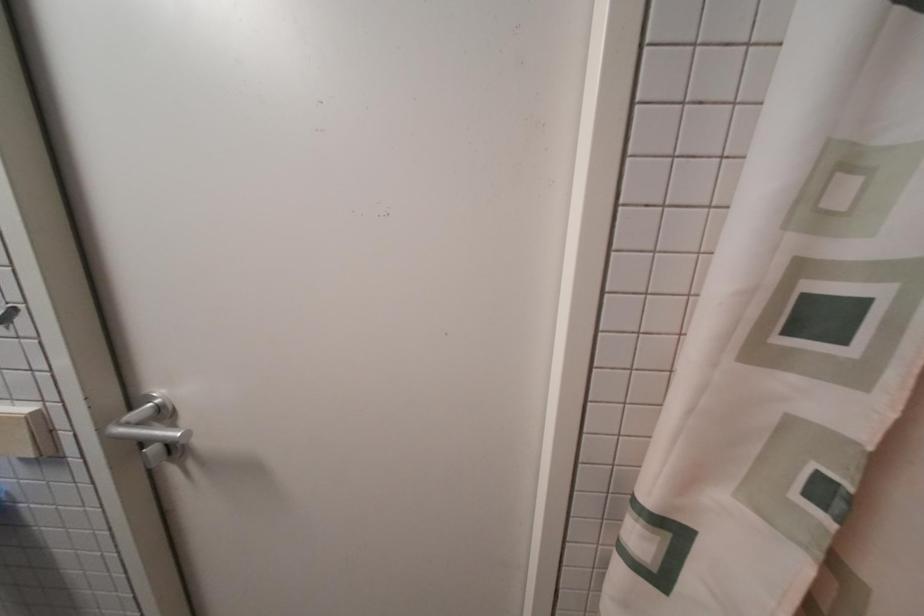
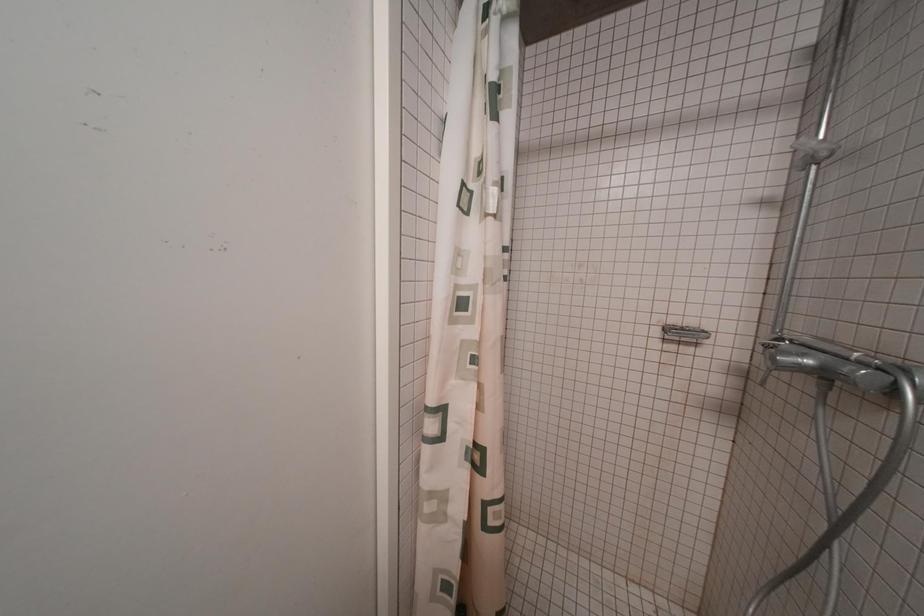
Question: The images are taken continuously from a first-person perspective. In which direction is your viewpoint rotating?

Choices:
 (A) Left
 (B) Right
 (C) Up
 (D) Down

Answer: (B)